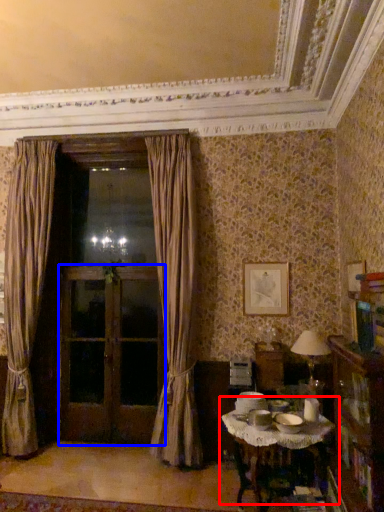
Question: Which of the following is the closest to the observer, table (highlighted by a red box) or screen door (highlighted by a blue box)?

Choices:
 (A) table
 (B) screen door

Answer: (A)